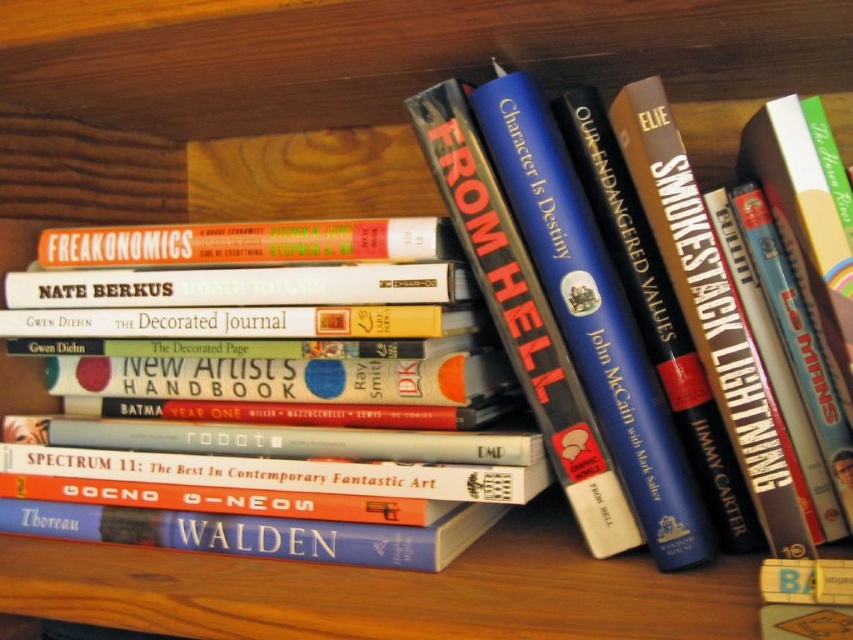
You are organizing a bookshelf and need to place a new book that is 10 cm wide. You see the blue hardcover book at center and the orange matte hardcover book at center. Which book has a width that allows the new book to fit next to it?

The blue hardcover book at center has a lesser width compared to the orange matte hardcover book at center. Since the new book is 10 cm wide, it can fit next to either book, but there might be more space available next to the orange matte hardcover book at center due to its greater width, allowing for a better fit.

You are standing in front of the wooden shelf with books. You see two points marked on the shelf. The first point is at coordinates point (490, 195) and the second is at point (480, 499). Which point is closer to you?

Point (490, 195) is closer to you because it is further to the viewer than point (480, 499).